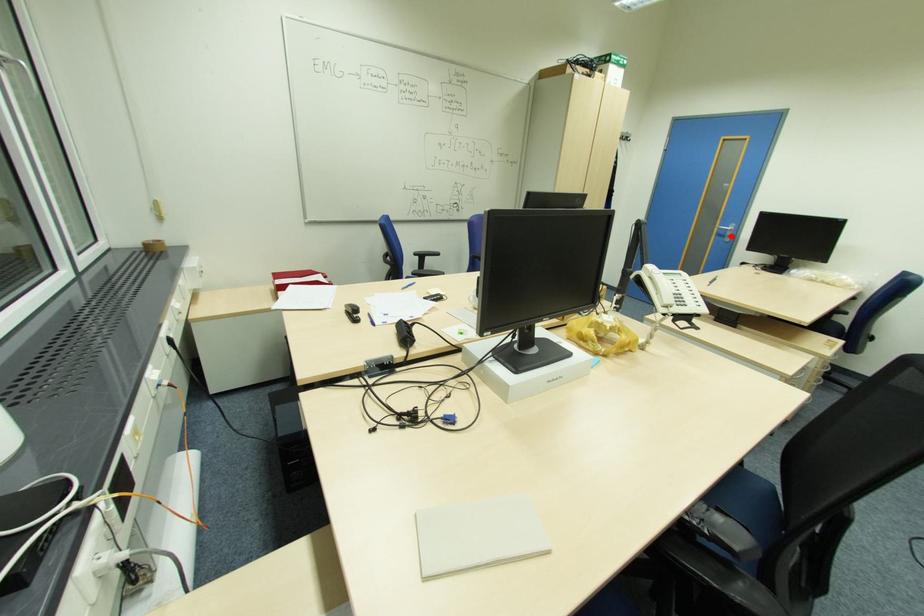
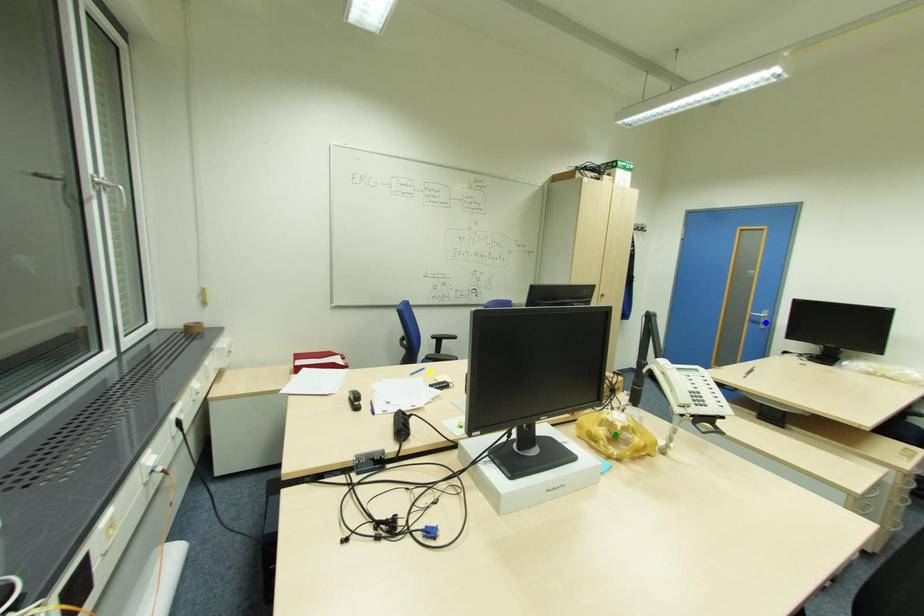
Question: I am providing you with two images of the same scene from different viewpoints. A red point is marked on the first image. You are given multiple points on the second image. Can you choose the point in image 2 that corresponds to the point in image 1?

Choices:
 (A) blue point
 (B) yellow point
 (C) green point

Answer: (A)